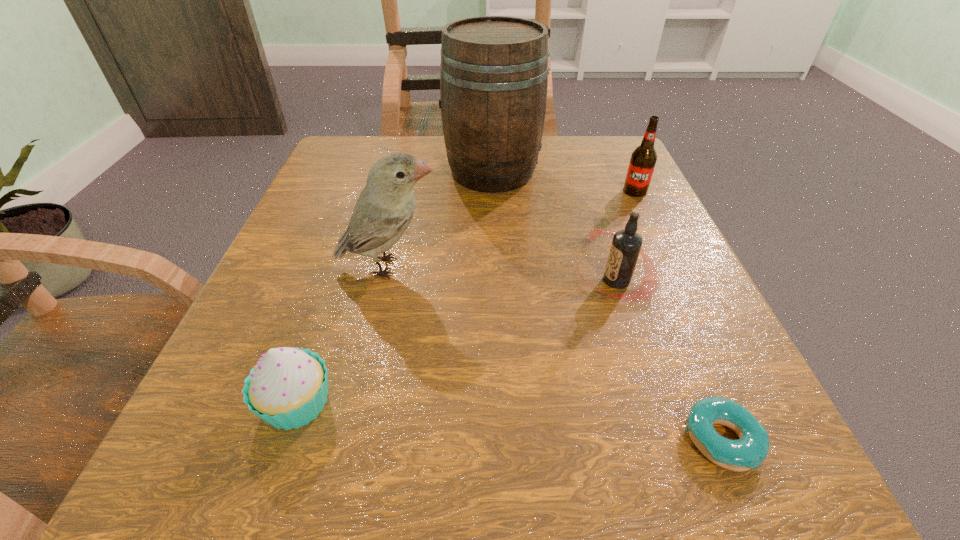
In the image, there is a desktop. At what (x,y) coordinates should I click in order to perform the action: click on vacant area at the right edge. Please return your answer as a coordinate pair (x, y). Looking at the image, I should click on (609, 209).

Image resolution: width=960 pixels, height=540 pixels. What are the coordinates of `free spot at the far left corner of the desktop` in the screenshot? It's located at (357, 168).

Where is `vacant area at the near left corner of the desktop`? This screenshot has height=540, width=960. vacant area at the near left corner of the desktop is located at coordinates (280, 477).

Find the location of a particular element. This screenshot has width=960, height=540. free spot at the far right corner of the desktop is located at coordinates (607, 151).

Locate an element on the screen. free space between the second tallest object and the left root beer is located at coordinates (502, 274).

I want to click on free space that is in between the tallest object and the bird, so click(441, 219).

Locate an element on the screen. The width and height of the screenshot is (960, 540). empty location between the cupcake and the second tallest object is located at coordinates 343,335.

The height and width of the screenshot is (540, 960). Identify the location of free space between the farther root beer and the cider. 564,181.

Find the location of a particular element. This screenshot has width=960, height=540. free space between the second shortest object and the farther root beer is located at coordinates (466, 297).

The width and height of the screenshot is (960, 540). Find the location of `vacant space that's between the second shortest object and the shortest object`. vacant space that's between the second shortest object and the shortest object is located at coordinates (509, 421).